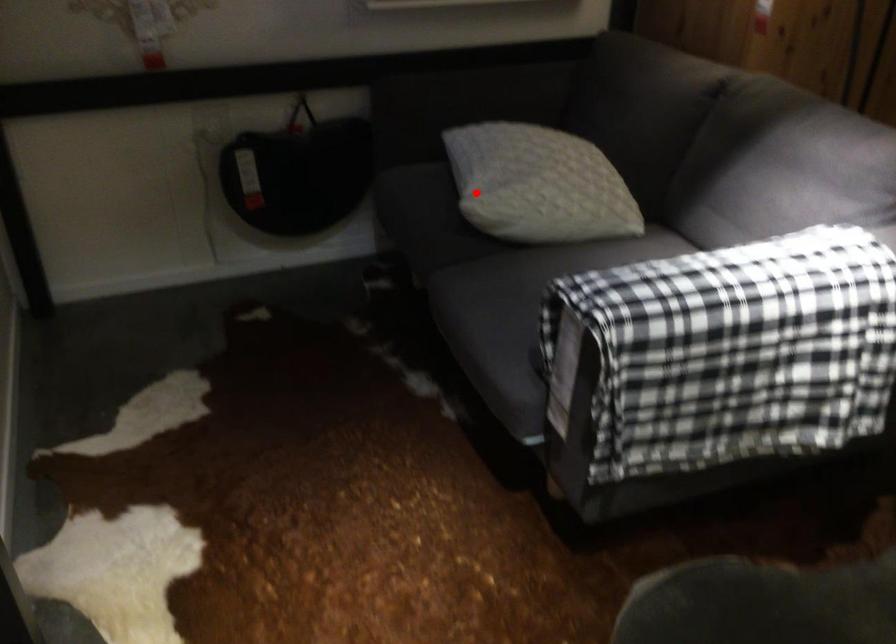
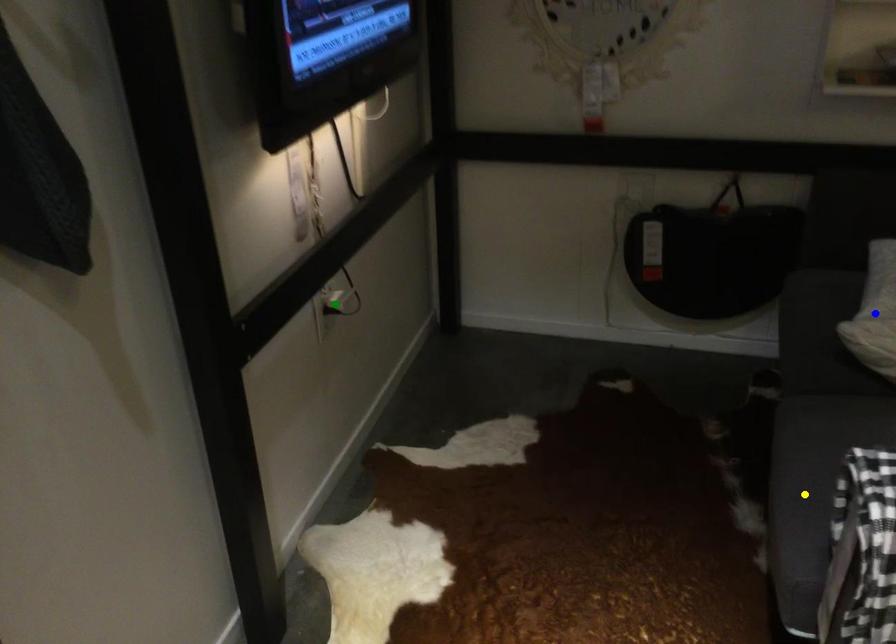
Question: I am providing you with two images of the same scene from different viewpoints. A red point is marked on the first image. You are given multiple points on the second image. Can you choose the point in image 2 that corresponds to the point in image 1?

Choices:
 (A) yellow point
 (B) green point
 (C) blue point

Answer: (C)